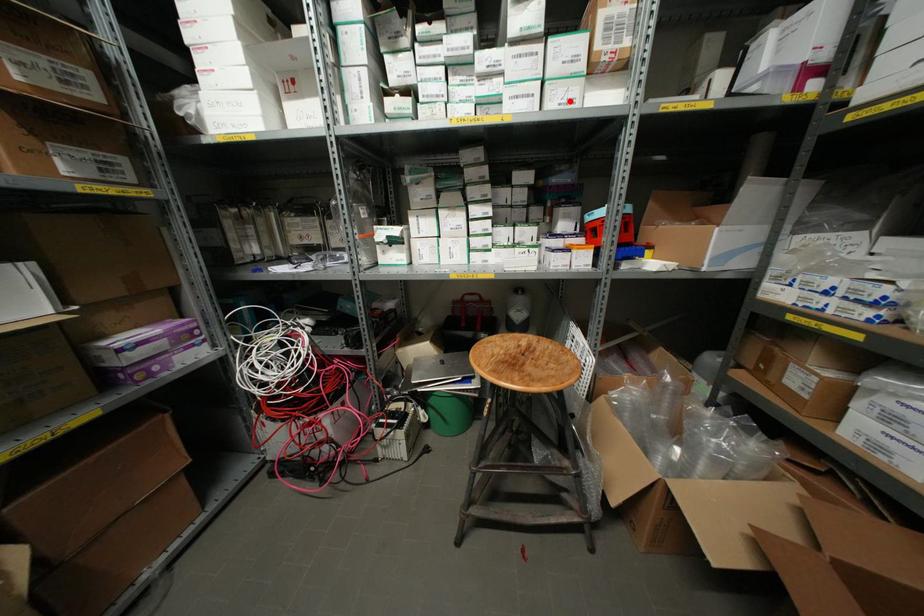
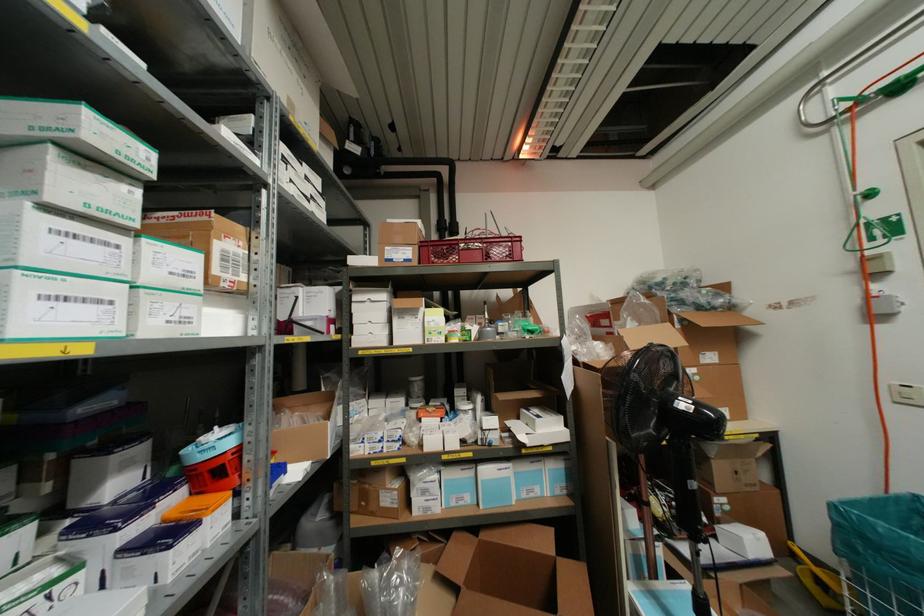
Find the pixel in the second image that matches the highlighted location in the first image.

(185, 320)